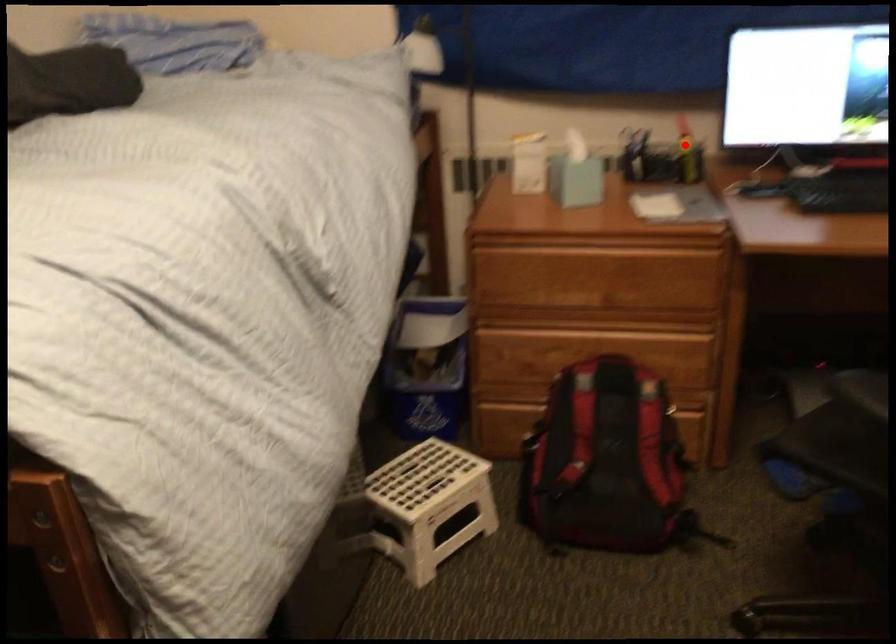
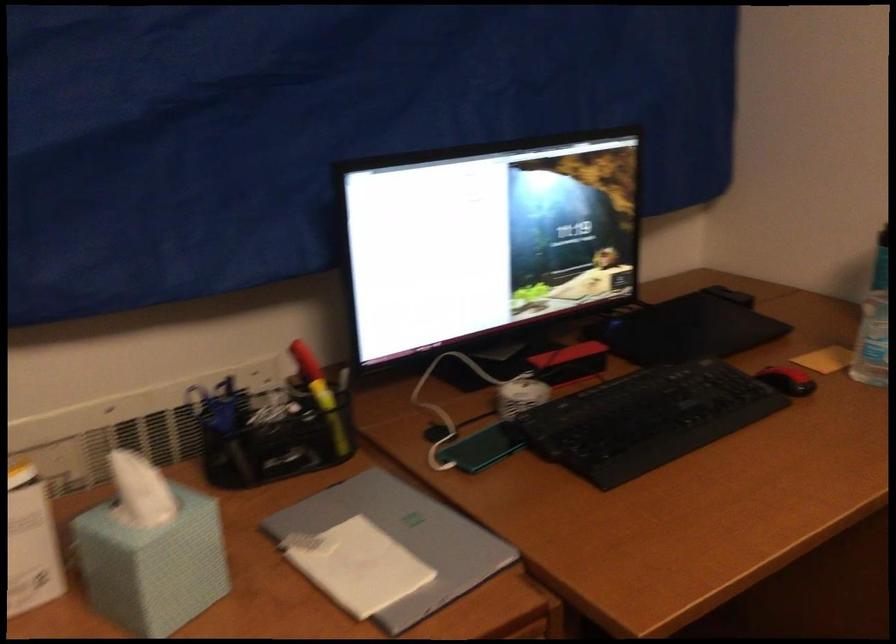
Find the pixel in the second image that matches the highlighted location in the first image.

(321, 395)